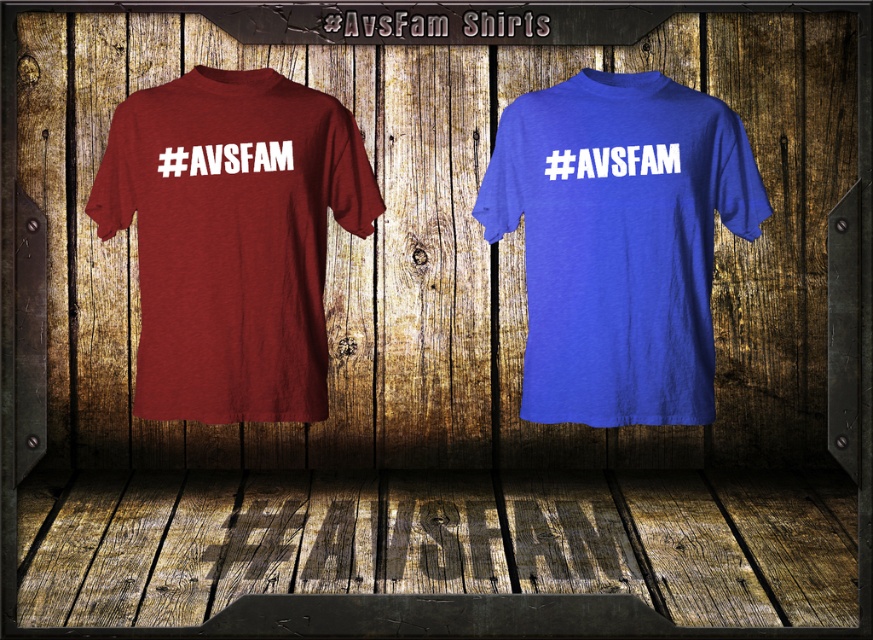
You are a customer looking at the shirts displayed on the rustic wooden backdrop. The maroon heather tee at left is located at point (232, 237). Can you tell me the exact coordinates of the maroon heather tee at left?

The maroon heather tee at left is located at point (232, 237).